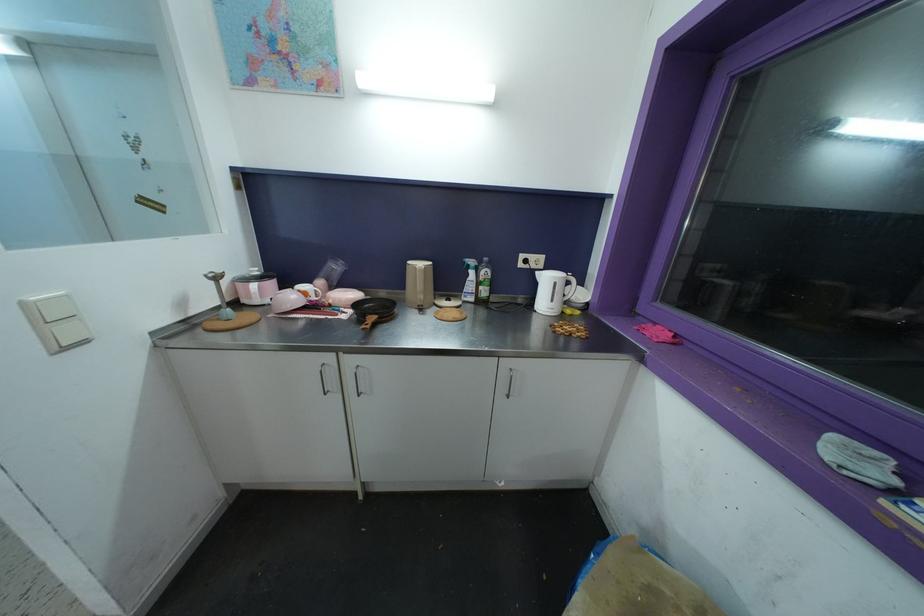
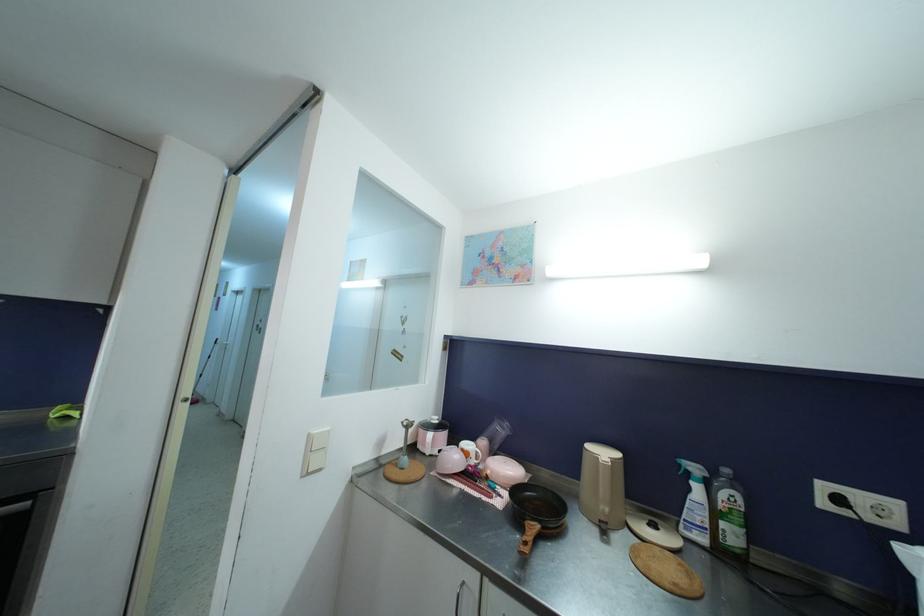
The point at (524,267) is marked in the first image. Where is the corresponding point in the second image?

(827, 507)